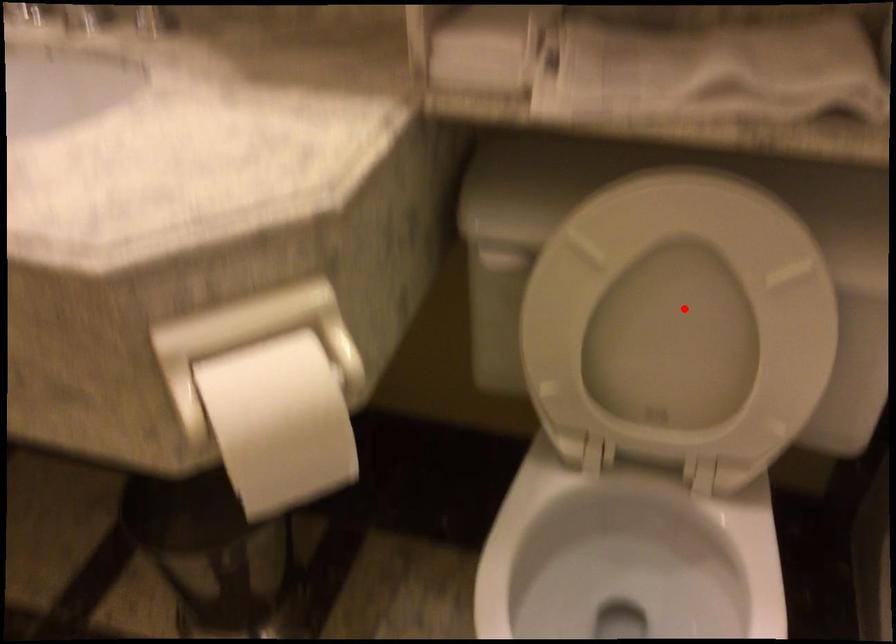
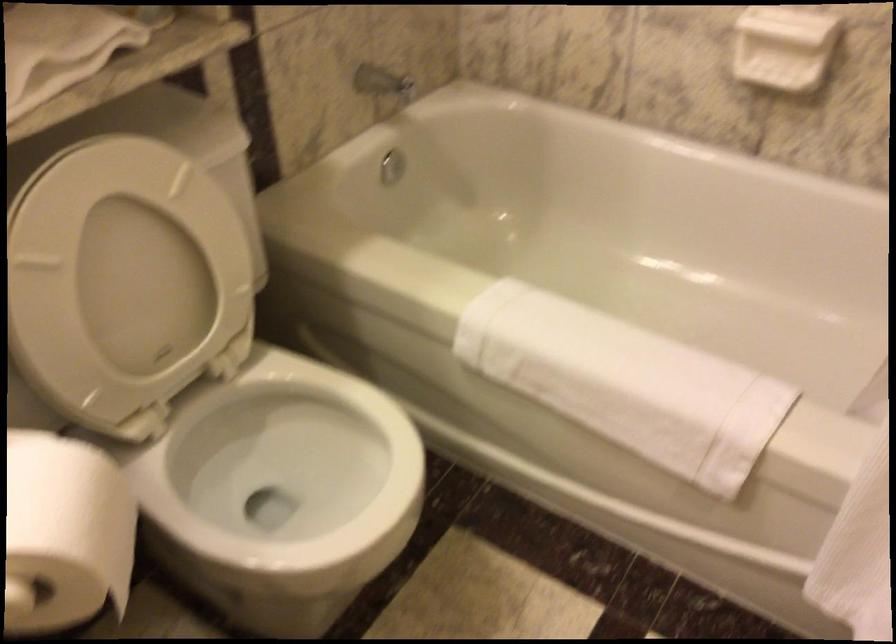
Question: I am providing you with two images of the same scene from different viewpoints. A red point is marked on the first image. Can you still see the location of the red point in image 2?

Choices:
 (A) Yes
 (B) No

Answer: (A)